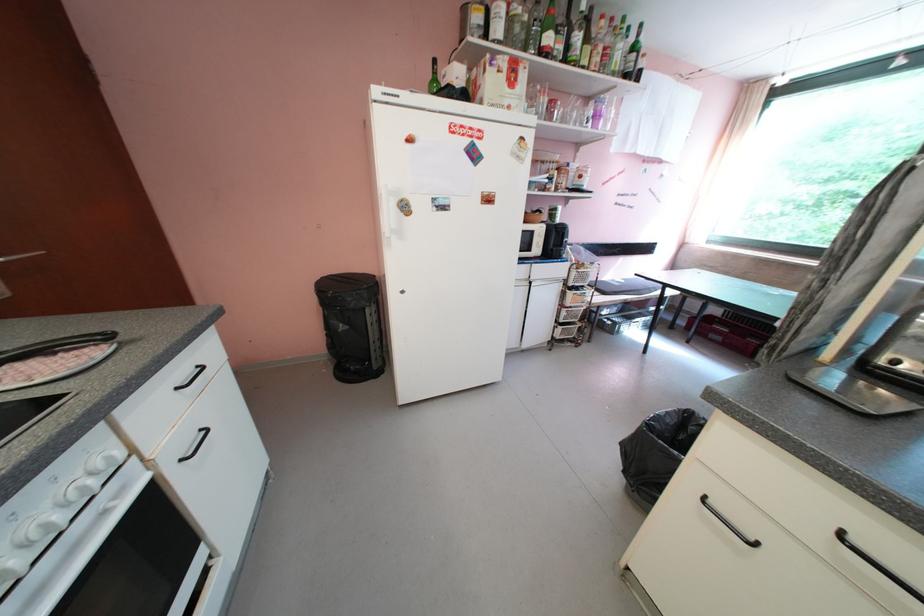
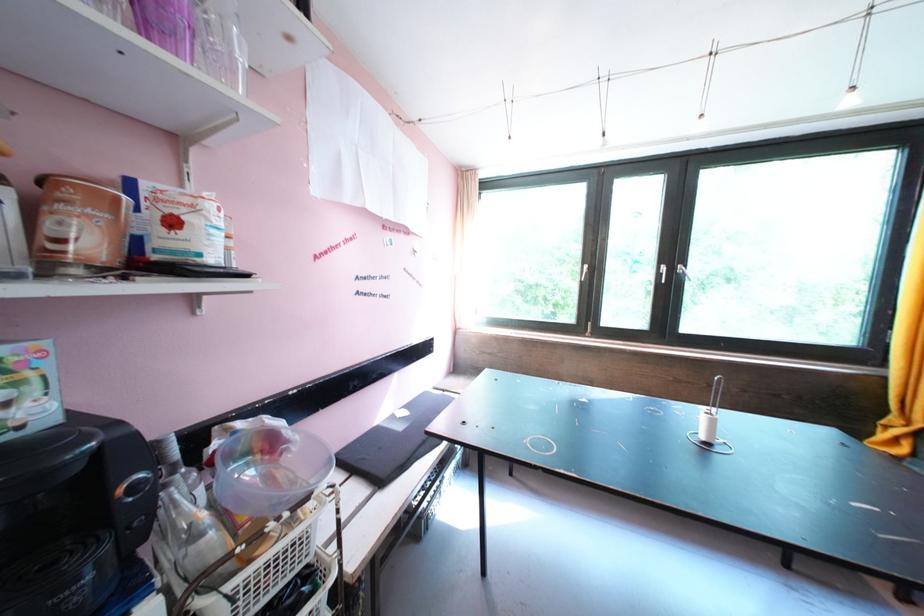
Find the pixel in the second image that matches point (572, 174) in the first image.

(78, 196)